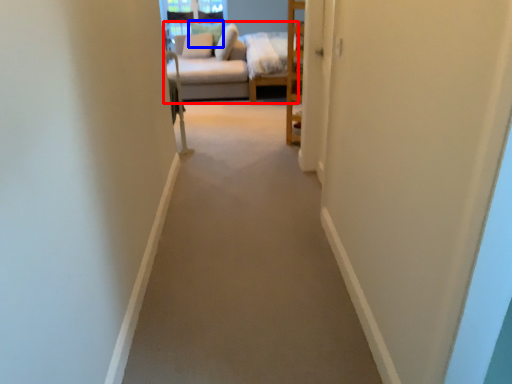
Question: Which of the following is the farthest to the observer, studio couch (highlighted by a red box) or pillow (highlighted by a blue box)?

Choices:
 (A) studio couch
 (B) pillow

Answer: (B)